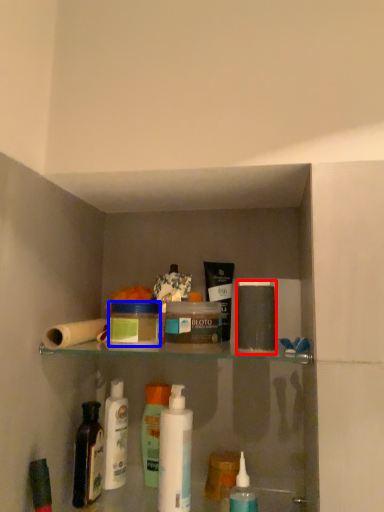
Question: Which object is closer to the camera taking this photo, toiletry (highlighted by a red box) or product (highlighted by a blue box)?

Choices:
 (A) toiletry
 (B) product

Answer: (A)